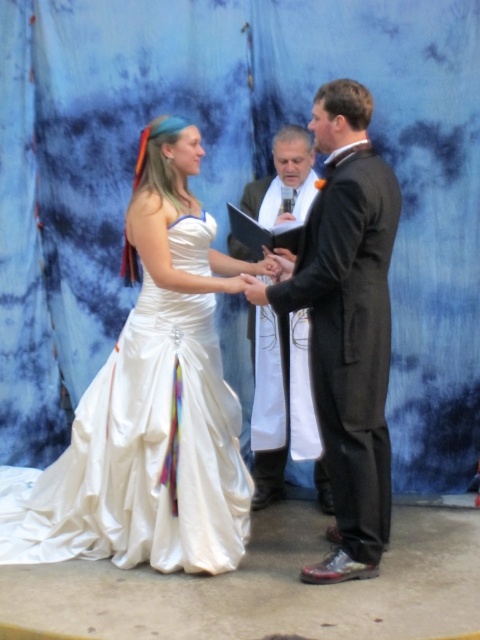
Question: Observing the image, what is the correct spatial positioning of white satin dress at center in reference to black satin suit at center?

Choices:
 (A) right
 (B) left

Answer: (B)

Question: Among these objects, which one is nearest to the camera?

Choices:
 (A) satin white dress at center
 (B) shiny black suit at center
 (C) black satin suit at center

Answer: (B)

Question: Which point appears farthest from the camera in this image?

Choices:
 (A) (112, 492)
 (B) (189, 540)
 (C) (326, 122)

Answer: (A)

Question: Considering the relative positions of white satin dress at center and black satin suit at center in the image provided, where is white satin dress at center located with respect to black satin suit at center?

Choices:
 (A) right
 (B) left

Answer: (B)

Question: Estimate the real-world distances between objects in this image. Which object is farther from the black satin suit at center?

Choices:
 (A) satin white dress at center
 (B) white satin dress at center

Answer: (A)

Question: Can you confirm if satin white dress at center is positioned to the right of black satin suit at center?

Choices:
 (A) no
 (B) yes

Answer: (A)